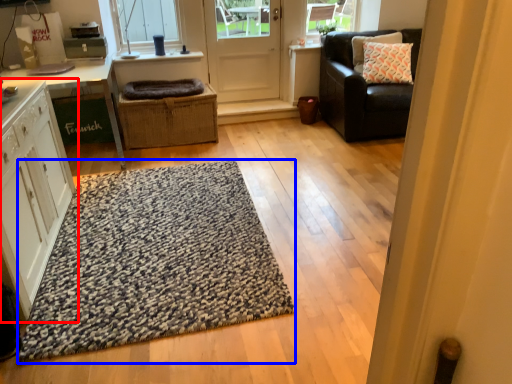
Question: Which object appears farthest to the camera in this image, cabinetry (highlighted by a red box) or doormat (highlighted by a blue box)?

Choices:
 (A) cabinetry
 (B) doormat

Answer: (B)